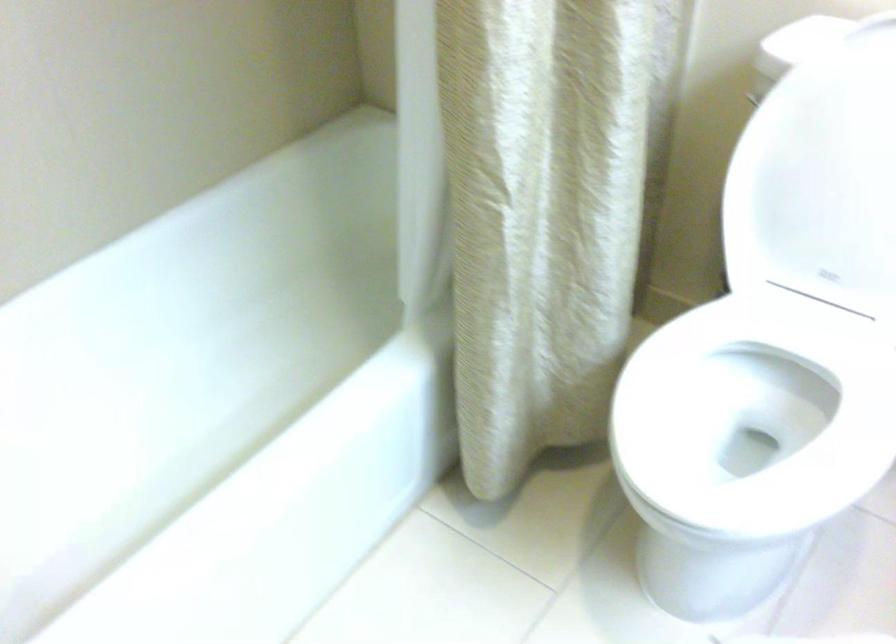
Find where to lift the white toilet seat. Please return your answer as a coordinate pair (x, y).

(752, 420)